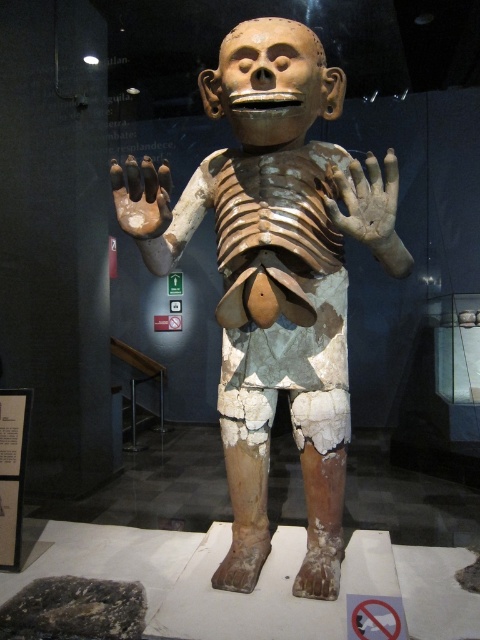
Which is more to the left, matte clay skeleton at center or matte clay hand at center?

matte clay skeleton at center is more to the left.

Does matte clay skeleton at center appear over matte clay hand at center?

No, matte clay skeleton at center is not above matte clay hand at center.

Find the location of `matte clay skeleton at center`. matte clay skeleton at center is located at coordinates (275, 285).

Does matte clay hand at center appear under brown matte hand at center?

Yes.

This screenshot has width=480, height=640. What do you see at coordinates (370, 205) in the screenshot?
I see `matte clay hand at center` at bounding box center [370, 205].

Find the location of a particular element. The image size is (480, 640). matte clay hand at center is located at coordinates (370, 205).

Does matte clay skeleton at center have a lesser width compared to brown matte hand at center?

No.

Between point (273, 284) and point (115, 182), which one is positioned behind?

Positioned behind is point (273, 284).

Identify the location of matte clay skeleton at center. (275, 285).